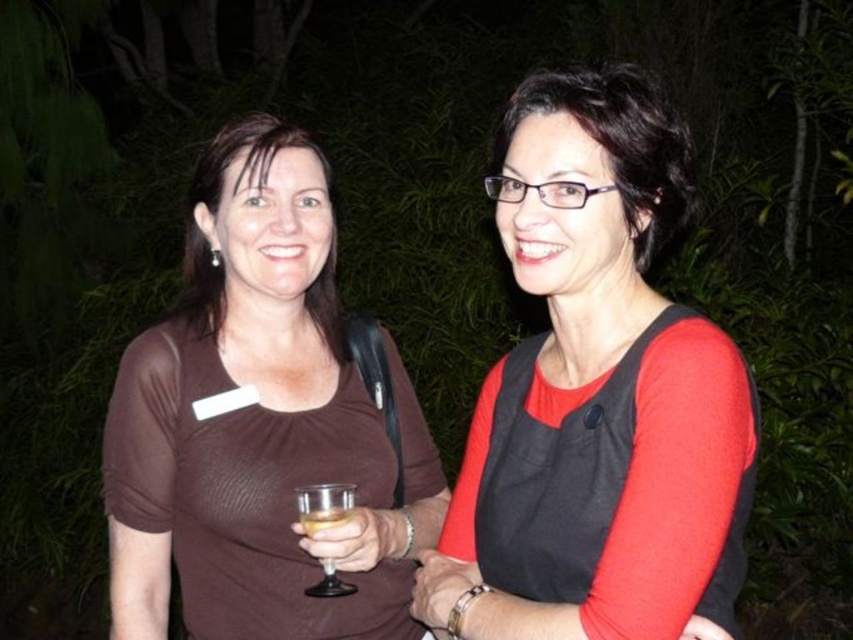
Question: Can you confirm if red matte dress at center is positioned above brown matte shirt at center?

Choices:
 (A) yes
 (B) no

Answer: (A)

Question: Is matte black glasses at upper center below matte brown blouse at left?

Choices:
 (A) no
 (B) yes

Answer: (A)

Question: Based on their relative distances, which object is farther from the red matte dress at center?

Choices:
 (A) matte black glasses at upper center
 (B) matte brown blouse at left
 (C) clear glass wine glass at center
 (D) brown matte shirt at center

Answer: (B)

Question: Which point is farther from the camera taking this photo?

Choices:
 (A) (511, 371)
 (B) (310, 522)
 (C) (662, 243)
 (D) (315, 324)

Answer: (D)

Question: Estimate the real-world distances between objects in this image. Which object is closer to the red matte dress at center?

Choices:
 (A) clear glass wine glass at center
 (B) matte brown blouse at left
 (C) matte black glasses at upper center

Answer: (C)

Question: From the image, what is the correct spatial relationship of red matte dress at center in relation to brown matte shirt at center?

Choices:
 (A) below
 (B) above

Answer: (B)